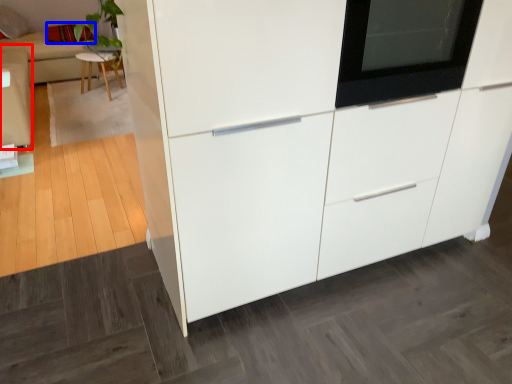
Question: Which of the following is the farthest to the observer, couch (highlighted by a red box) or pillow (highlighted by a blue box)?

Choices:
 (A) couch
 (B) pillow

Answer: (B)